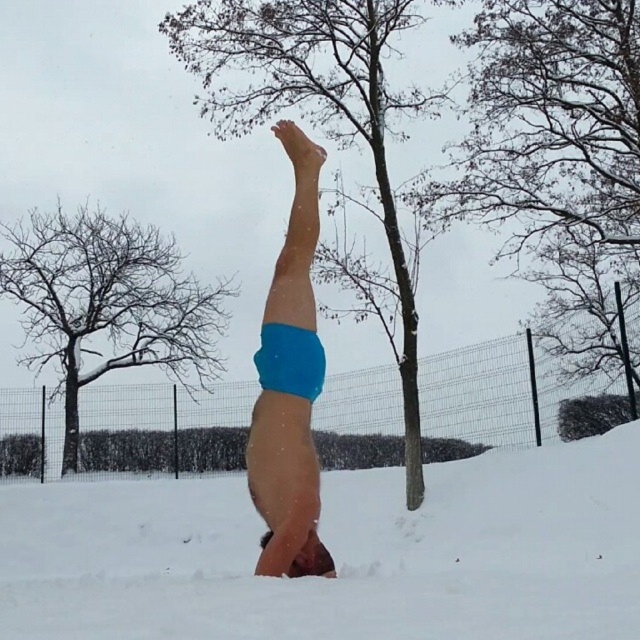
Who is positioned more to the left, white powdery snow at center or blue fabric shorts at center?

Positioned to the left is white powdery snow at center.

Between white powdery snow at center and blue fabric shorts at center, which one has less height?

white powdery snow at center is shorter.

Does point (230, 541) lie in front of point (301, 557)?

No, it is behind (301, 557).

Find the location of a particular element. The width and height of the screenshot is (640, 640). white powdery snow at center is located at coordinates (339, 554).